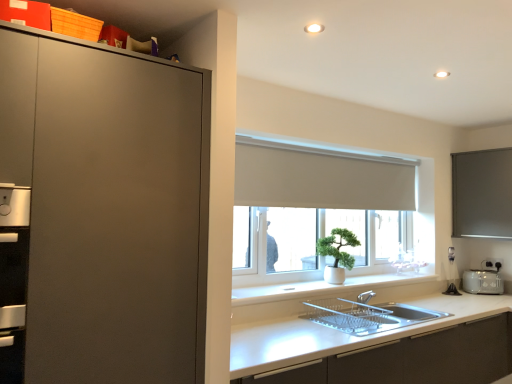
Question: Is white matte window at center smaller than matte gray window screen at right?

Choices:
 (A) yes
 (B) no

Answer: (B)

Question: Does white matte window at center contain matte gray window screen at right?

Choices:
 (A) no
 (B) yes

Answer: (A)

Question: Is white matte window at center to the right of matte gray window screen at right from the viewer's perspective?

Choices:
 (A) yes
 (B) no

Answer: (B)

Question: Is white matte window at center positioned beyond the bounds of matte gray window screen at right?

Choices:
 (A) no
 (B) yes

Answer: (B)

Question: Is white matte window at center to the left of matte gray window screen at right from the viewer's perspective?

Choices:
 (A) no
 (B) yes

Answer: (B)

Question: From a real-world perspective, is matte gray window screen at right positioned above or below white smooth window sill at center?

Choices:
 (A) below
 (B) above

Answer: (B)

Question: In the image, is matte gray window screen at right positioned in front of or behind white smooth window sill at center?

Choices:
 (A) behind
 (B) front

Answer: (A)

Question: Considering the positions of point (467, 193) and point (412, 274), is point (467, 193) closer or farther from the camera than point (412, 274)?

Choices:
 (A) farther
 (B) closer

Answer: (B)

Question: Is matte gray window screen at right wider or thinner than white smooth window sill at center?

Choices:
 (A) thin
 (B) wide

Answer: (B)

Question: Looking at the image, does matte gray window screen at right seem bigger or smaller compared to white matte window at center?

Choices:
 (A) small
 (B) big

Answer: (A)

Question: From their relative heights in the image, would you say matte gray window screen at right is taller or shorter than white matte window at center?

Choices:
 (A) tall
 (B) short

Answer: (B)

Question: Considering the positions of point (502, 218) and point (248, 243), is point (502, 218) closer or farther from the camera than point (248, 243)?

Choices:
 (A) closer
 (B) farther

Answer: (B)

Question: Is matte gray window screen at right spatially inside white matte window at center, or outside of it?

Choices:
 (A) outside
 (B) inside

Answer: (A)

Question: Looking at the image, does white matte cabinet at lower center seem bigger or smaller compared to white plastic toaster at right?

Choices:
 (A) small
 (B) big

Answer: (B)

Question: From the image's perspective, is white matte cabinet at lower center located above or below white plastic toaster at right?

Choices:
 (A) below
 (B) above

Answer: (A)